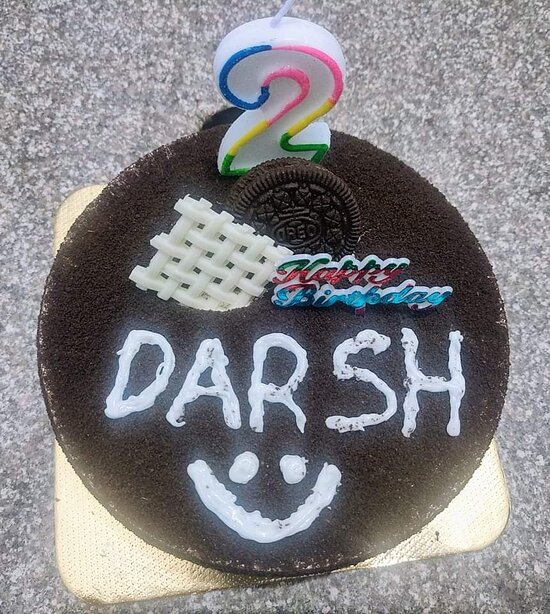
The height and width of the screenshot is (614, 550). In order to click on white surface in this screenshot , I will do `click(474, 503)`, `click(101, 562)`, `click(76, 218)`.